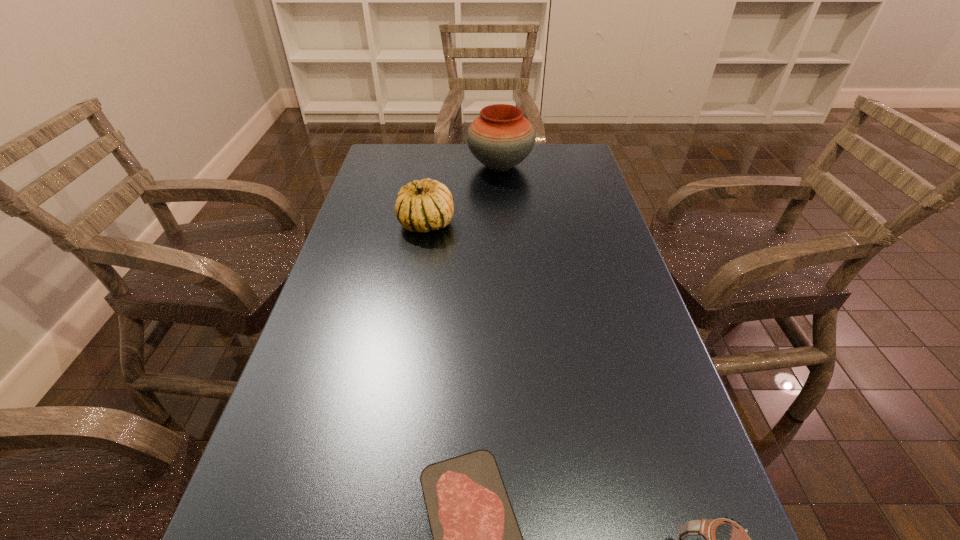
You are a GUI agent. You are given a task and a screenshot of the screen. Output one action in this format:
    pyautogui.click(x=<x>, y=<y>)
    Task: Click on the farthest object
    
    Given the screenshot: What is the action you would take?
    pyautogui.click(x=500, y=138)

Find the location of a particular element. The image size is (960, 540). the tallest object is located at coordinates (500, 138).

At what (x,y) coordinates should I click in order to perform the action: click on the third nearest object. Please return your answer as a coordinate pair (x, y). Looking at the image, I should click on (421, 206).

Identify the location of gourd. This screenshot has width=960, height=540. (421, 206).

The image size is (960, 540). What are the coordinates of `vacant space located on the left of the farthest object` in the screenshot? It's located at (401, 166).

The image size is (960, 540). In order to click on blank space located 0.140m on the right of the second tallest object in this screenshot , I will do `click(505, 224)`.

Identify the location of object that is positioned at the far edge. (500, 138).

Where is `object located at the left edge`? The width and height of the screenshot is (960, 540). object located at the left edge is located at coordinates (421, 206).

The width and height of the screenshot is (960, 540). I want to click on free space at the far edge, so click(462, 168).

Where is `free space at the left edge of the desktop`? This screenshot has width=960, height=540. free space at the left edge of the desktop is located at coordinates (325, 359).